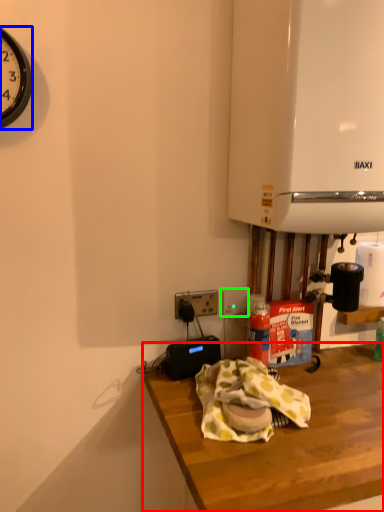
Question: Considering the real-world distances, which object is farthest from desk (highlighted by a red box)? clock (highlighted by a blue box) or electric outlet (highlighted by a green box)?

Choices:
 (A) clock
 (B) electric outlet

Answer: (A)